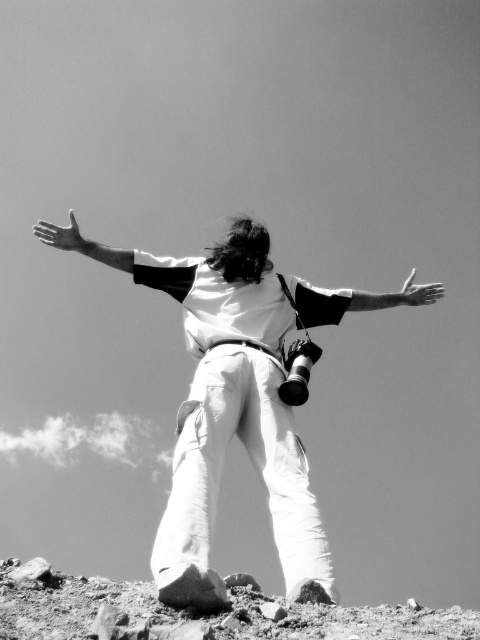
Question: Among these objects, which one is farthest from the camera?

Choices:
 (A) smooth white arm at center
 (B) matte black arm at upper left

Answer: (B)

Question: Does matte black arm at upper left have a larger size compared to matte white hand at upper left?

Choices:
 (A) yes
 (B) no

Answer: (A)

Question: Can you confirm if dirt/rock at lower center is positioned below matte white hand at upper left?

Choices:
 (A) yes
 (B) no

Answer: (A)

Question: Estimate the real-world distances between objects in this image. Which object is farther from the matte black arm at upper left?

Choices:
 (A) smooth white arm at center
 (B) white cotton pants at center
 (C) dirt/rock at lower center

Answer: (C)

Question: Considering the relative positions of dirt/rock at lower center and matte black arm at upper left in the image provided, where is dirt/rock at lower center located with respect to matte black arm at upper left?

Choices:
 (A) below
 (B) above

Answer: (A)

Question: Among these objects, which one is farthest from the camera?

Choices:
 (A) white matte hand at upper center
 (B) smooth white arm at center
 (C) dirt/rock at lower center
 (D) white cotton pants at center

Answer: (A)